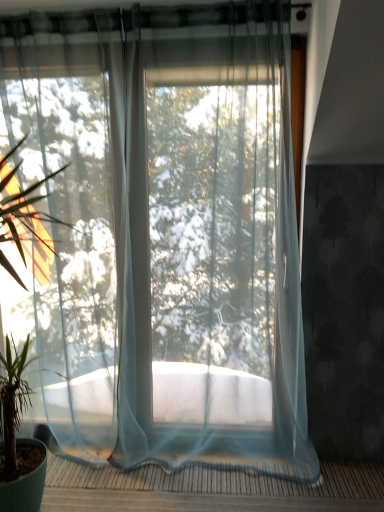
You are a GUI agent. You are given a task and a screenshot of the screen. Output one action in this format:
    pyautogui.click(x=<x>, y=<y>)
    Task: Click on the green leafy plant at left
    The height and width of the screenshot is (512, 384).
    Given the screenshot: What is the action you would take?
    pyautogui.click(x=15, y=437)

The width and height of the screenshot is (384, 512). What do you see at coordinates (15, 437) in the screenshot?
I see `green leafy plant at left` at bounding box center [15, 437].

This screenshot has width=384, height=512. I want to click on green leafy plant at left, so click(x=15, y=437).